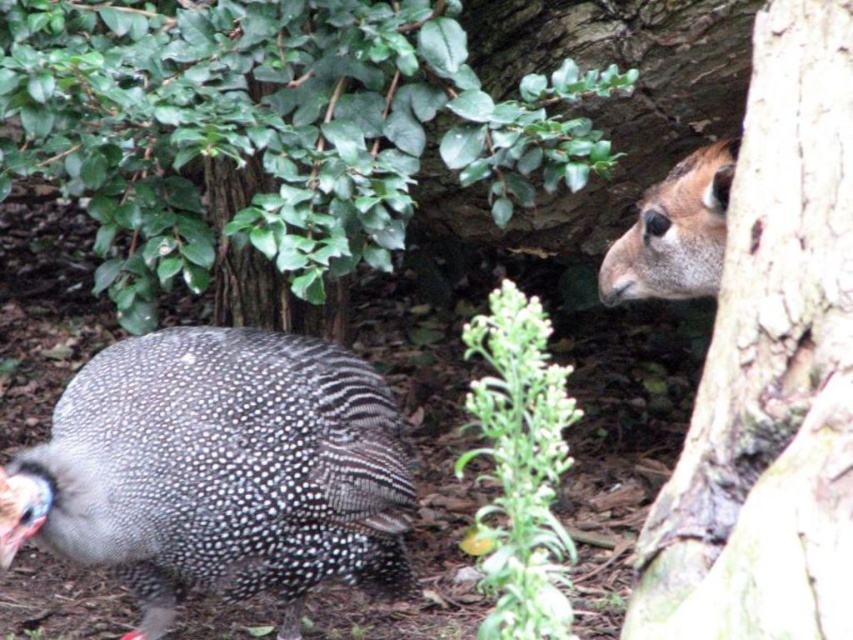
From the picture: Can you confirm if brown rough tree trunk at right is positioned to the left of speckled feathered guinea fowl at lower left?

In fact, brown rough tree trunk at right is to the right of speckled feathered guinea fowl at lower left.

Does point (839, 186) lie in front of point (196, 388)?

Yes, point (839, 186) is closer to viewer.

Describe the element at coordinates (770, 371) in the screenshot. The width and height of the screenshot is (853, 640). I see `brown rough tree trunk at right` at that location.

Locate an element on the screen. brown rough tree trunk at right is located at coordinates (770, 371).

Which is behind, point (566, 163) or point (302, 548)?

Positioned behind is point (566, 163).

Does green leafy bush at upper left have a lesser height compared to speckled feathered guinea fowl at lower left?

Incorrect, green leafy bush at upper left's height does not fall short of speckled feathered guinea fowl at lower left's.

Describe the element at coordinates (270, 129) in the screenshot. I see `green leafy bush at upper left` at that location.

Locate an element on the screen. green leafy bush at upper left is located at coordinates (270, 129).

Can you confirm if speckled feathered guinea fowl at lower left is positioned to the right of green leafy plant at center?

Incorrect, speckled feathered guinea fowl at lower left is not on the right side of green leafy plant at center.

Based on the photo, is speckled feathered guinea fowl at lower left below green leafy plant at center?

Incorrect, speckled feathered guinea fowl at lower left is not positioned below green leafy plant at center.

Who is more forward, (x=312, y=436) or (x=511, y=397)?

Point (x=511, y=397)

At what (x,y) coordinates should I click in order to perform the action: click on speckled feathered guinea fowl at lower left. Please return your answer as a coordinate pair (x, y). Looking at the image, I should click on (219, 472).